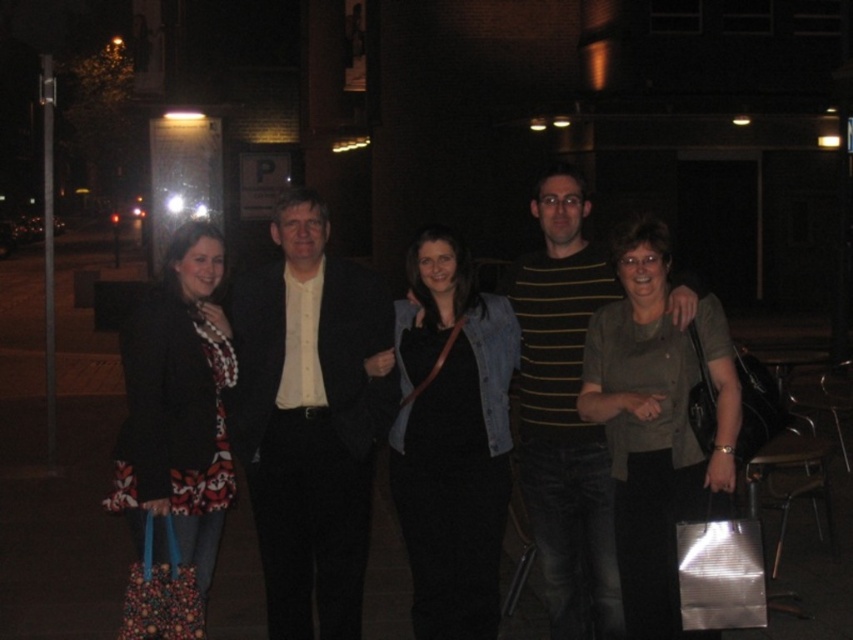
Question: Among these objects, which one is farthest from the camera?

Choices:
 (A) striped cotton shirt at center
 (B) floral fabric bag at left
 (C) matte gray shirt at center

Answer: (A)

Question: Among these objects, which one is nearest to the camera?

Choices:
 (A) denim jacket at center
 (B) matte gray shirt at center
 (C) striped cotton shirt at center

Answer: (B)

Question: Can you confirm if striped cotton shirt at center is positioned to the right of floral fabric bag at left?

Choices:
 (A) yes
 (B) no

Answer: (A)

Question: In this image, where is striped cotton shirt at center located relative to floral fabric bag at left?

Choices:
 (A) above
 (B) below

Answer: (A)

Question: Is the position of matte black suit at center more distant than that of striped cotton shirt at center?

Choices:
 (A) no
 (B) yes

Answer: (B)

Question: Which object is positioned closest to the floral fabric bag at left?

Choices:
 (A) matte gray shirt at center
 (B) denim jacket at center

Answer: (B)